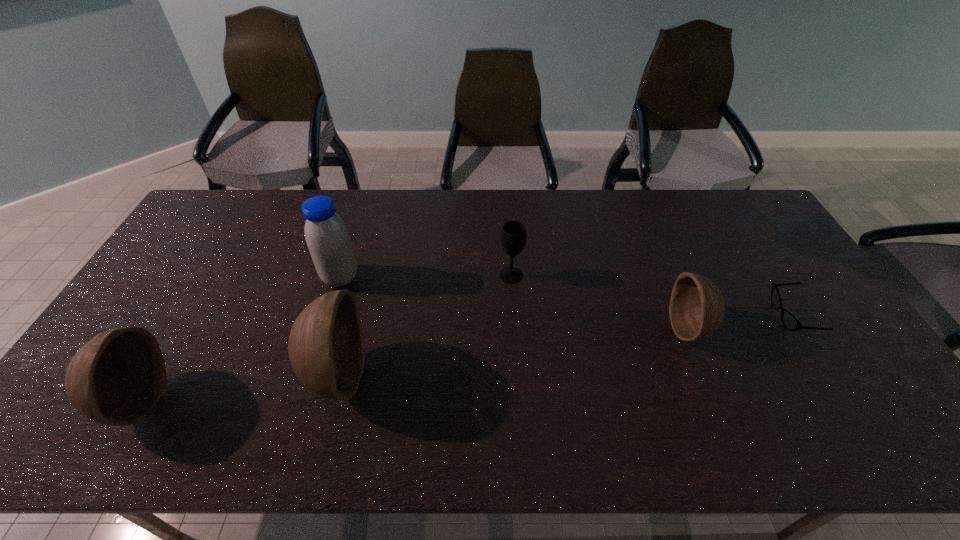
To achieve even spacing by inserting another bowl among them, please point to a vacant spot for this new bowl. Please provide its 2D coordinates. Your answer should be formatted as a tuple, i.e. [(x, y)], where the tuple contains the x and y coordinates of a point satisfying the conditions above.

[(520, 351)]